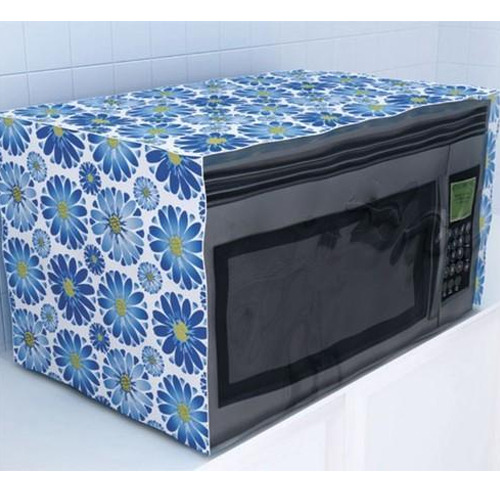
Identify the location of floral cover. (106, 307), (193, 111), (491, 195), (351, 83).